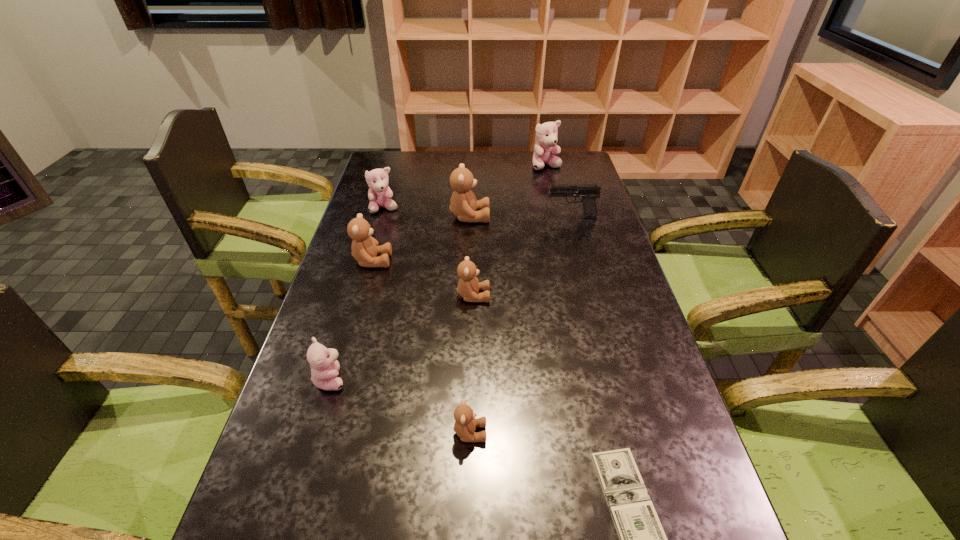
The image size is (960, 540). Identify the location of the rightmost pink teddy bear. (546, 134).

Locate an element on the screen. the farthest object is located at coordinates (546, 134).

You are a GUI agent. You are given a task and a screenshot of the screen. Output one action in this format:
    pyautogui.click(x=<x>, y=<y>)
    Task: Click on the biggest brown teddy bear
    This screenshot has height=540, width=960.
    Given the screenshot: What is the action you would take?
    pyautogui.click(x=463, y=204)

The height and width of the screenshot is (540, 960). I want to click on the second biggest pink teddy bear, so point(379,193).

I want to click on the leftmost brown teddy bear, so click(x=365, y=248).

You are a GUI agent. You are given a task and a screenshot of the screen. Output one action in this format:
    pyautogui.click(x=<x>, y=<y>)
    Task: Click on the third smallest brown teddy bear
    The image size is (960, 540).
    Given the screenshot: What is the action you would take?
    pyautogui.click(x=365, y=248)

Locate an element on the screen. pistol is located at coordinates (589, 192).

Locate an element on the screen. The width and height of the screenshot is (960, 540). the fourth nearest object is located at coordinates (468, 286).

Where is `the fifth farthest teddy bear`? the fifth farthest teddy bear is located at coordinates (468, 286).

Identify the location of the second nearest teddy bear. Image resolution: width=960 pixels, height=540 pixels. (323, 362).